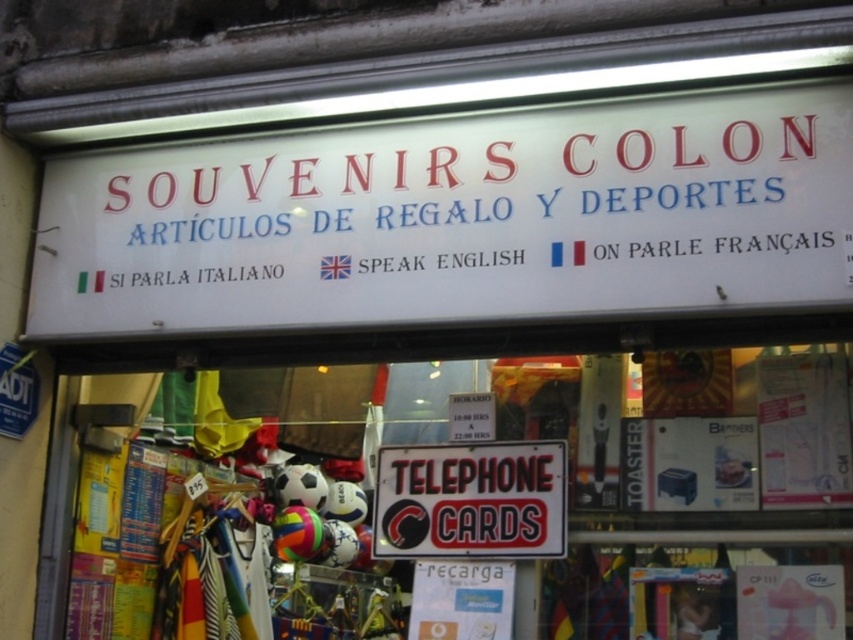
You are at the souvenir shop and need to choose between the white plastic telephone cards at center and the black plastic telephone cards at center for a gift. Which one is wider?

The white plastic telephone cards at center might be wider than black plastic telephone cards at center.

You are a traveler who wants to buy a telephone card to call home. You prefer a larger card for easier handling. Which one between the white plastic telephone cards at center and the black plastic telephone cards at center should you choose?

The white plastic telephone cards at center has a larger size compared to the black plastic telephone cards at center, so you should choose the white plastic telephone cards at center for easier handling.